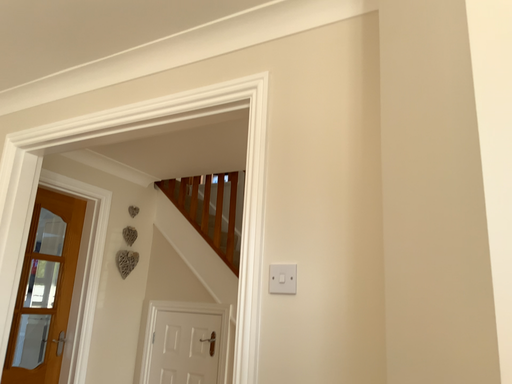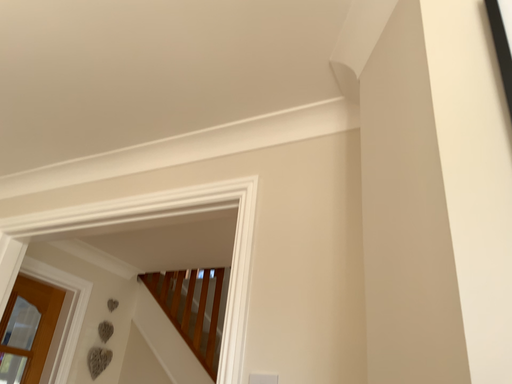
Question: Which way did the camera rotate in the video?

Choices:
 (A) rotated downward
 (B) rotated upward

Answer: (B)